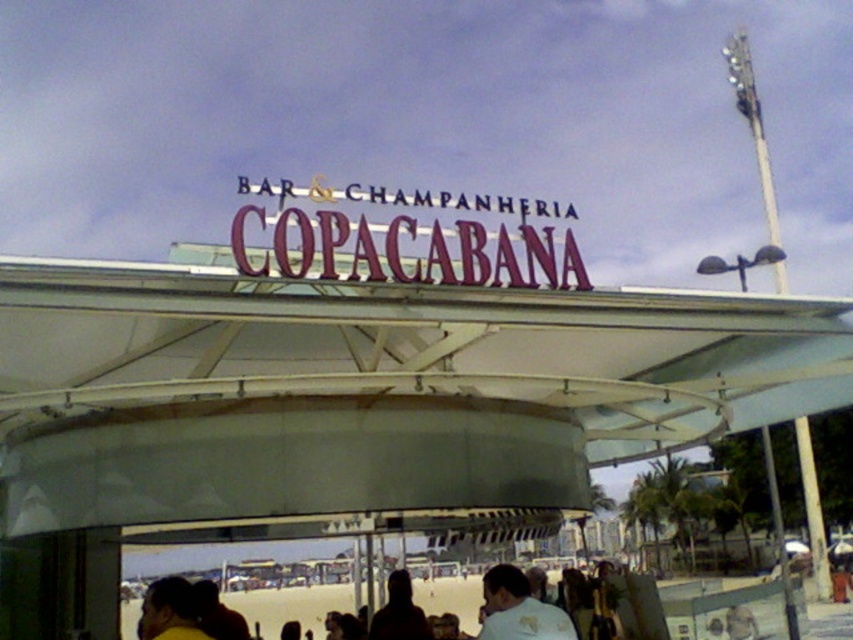
Question: Which point is farther from the camera taking this photo?

Choices:
 (A) (349, 307)
 (B) (143, 627)
 (C) (540, 612)

Answer: (C)

Question: Does metallic purple sign at center appear on the left side of yellow fabric hair at lower left?

Choices:
 (A) no
 (B) yes

Answer: (A)

Question: Does metallic purple sign at center appear on the right side of white cotton shirt at lower center?

Choices:
 (A) yes
 (B) no

Answer: (B)

Question: Which object appears farthest from the camera in this image?

Choices:
 (A) white cotton shirt at lower center
 (B) yellow fabric hair at lower left

Answer: (A)

Question: Which point is closer to the camera?

Choices:
 (A) (250, 324)
 (B) (288, 262)
 (C) (399, 568)

Answer: (B)

Question: Does metallic purple sign at center have a greater width compared to silky black hair at center?

Choices:
 (A) no
 (B) yes

Answer: (B)